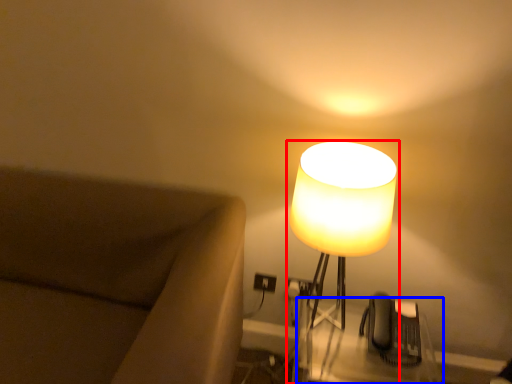
Question: Which point is further to the camera, lamp (highlighted by a red box) or table (highlighted by a blue box)?

Choices:
 (A) lamp
 (B) table

Answer: (B)